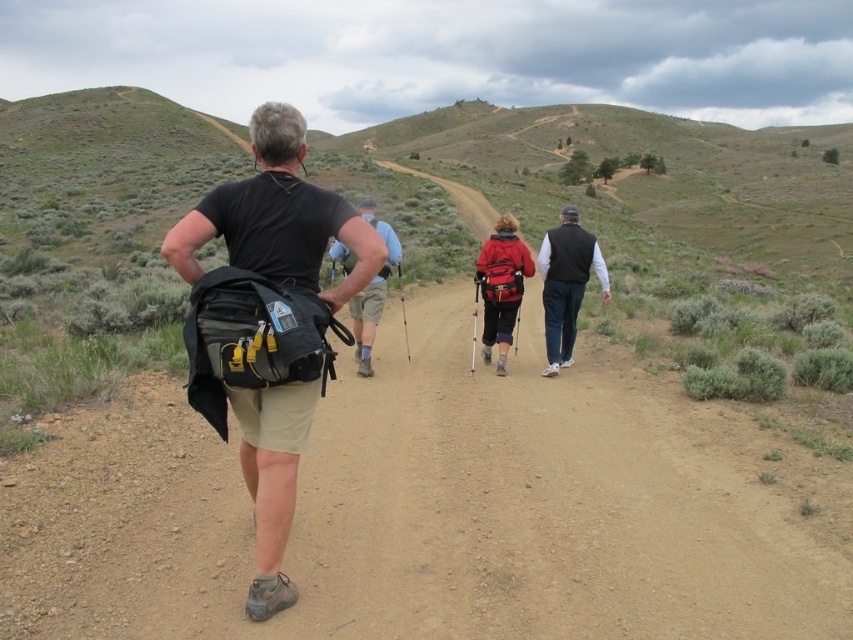
Looking at this image, which of these two, brown dirt track at center or black fabric backpack at center, stands shorter?

brown dirt track at center

Does point (668, 536) come farther from viewer compared to point (264, 419)?

Yes, point (668, 536) is behind point (264, 419).

The image size is (853, 640). Find the location of `brown dirt track at center`. brown dirt track at center is located at coordinates (421, 513).

The height and width of the screenshot is (640, 853). Find the location of `brown dirt track at center`. brown dirt track at center is located at coordinates (421, 513).

Can you confirm if brown dirt track at center is smaller than matte black backpack at center?

Yes.

Which is below, brown dirt track at center or matte black backpack at center?

brown dirt track at center is below.

Identify the location of brown dirt track at center. The image size is (853, 640). (421, 513).

Is red matte backpack at center taller than matte black backpack at center?

Correct, red matte backpack at center is much taller as matte black backpack at center.

Between point (502, 336) and point (361, 320), which one is positioned behind?

The point (502, 336) is behind.

Find the location of a particular element. The width and height of the screenshot is (853, 640). red matte backpack at center is located at coordinates [502, 285].

The height and width of the screenshot is (640, 853). Find the location of `red matte backpack at center`. red matte backpack at center is located at coordinates (502, 285).